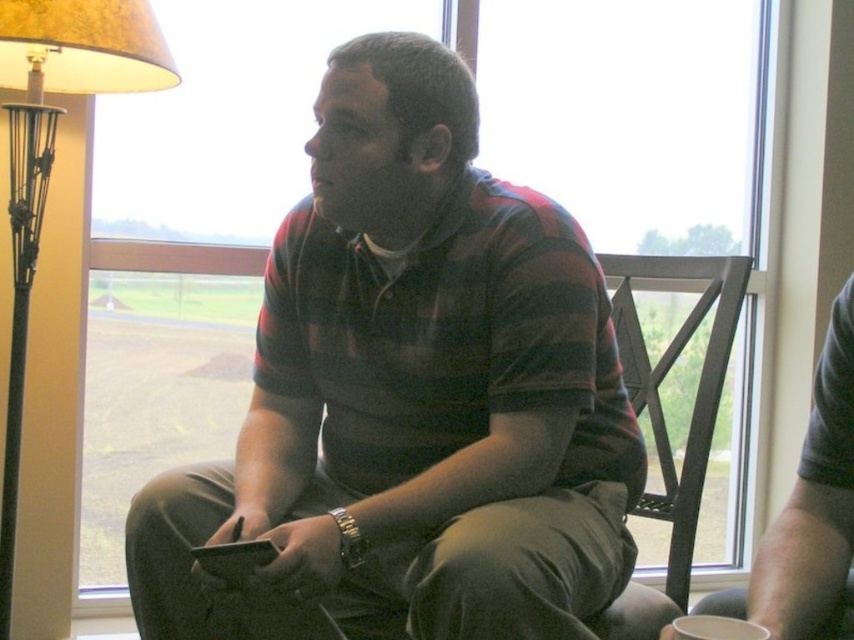
Question: Is gray fabric shirt at center thinner than black metal chair at right?

Choices:
 (A) yes
 (B) no

Answer: (A)

Question: Which point is farther to the camera?

Choices:
 (A) (656, 401)
 (B) (623, 627)

Answer: (A)

Question: Which object is positioned farthest from the black metal chair at right?

Choices:
 (A) gray fabric shirt at center
 (B) metallic gold lamp at left

Answer: (B)

Question: In this image, where is metallic gold lamp at left located relative to gray fabric shirt at center?

Choices:
 (A) left
 (B) right

Answer: (A)

Question: Which point is farther to the camera?

Choices:
 (A) (117, 1)
 (B) (648, 493)
 (C) (484, 228)

Answer: (B)

Question: Does metallic gold lamp at left have a lesser width compared to black metal chair at right?

Choices:
 (A) no
 (B) yes

Answer: (A)